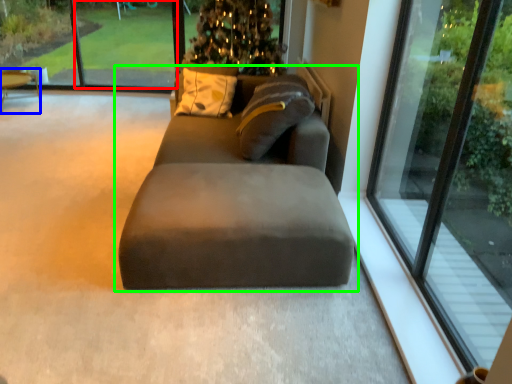
Question: Which object is the closest to the window screen (highlighted by a red box)? Choose among these: table (highlighted by a blue box) or studio couch (highlighted by a green box).

Choices:
 (A) table
 (B) studio couch

Answer: (A)